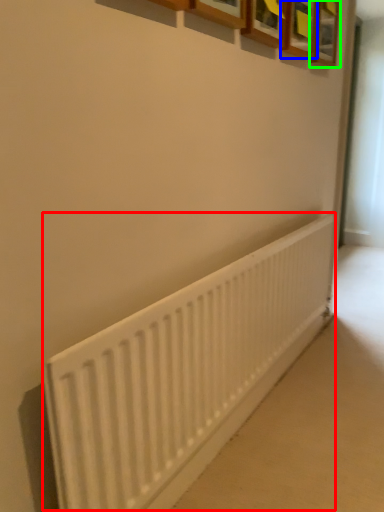
Question: Estimate the real-world distances between objects in this image. Which object is closer to radiator (highlighted by a red box), picture frame (highlighted by a blue box) or picture frame (highlighted by a green box)?

Choices:
 (A) picture frame
 (B) picture frame

Answer: (A)